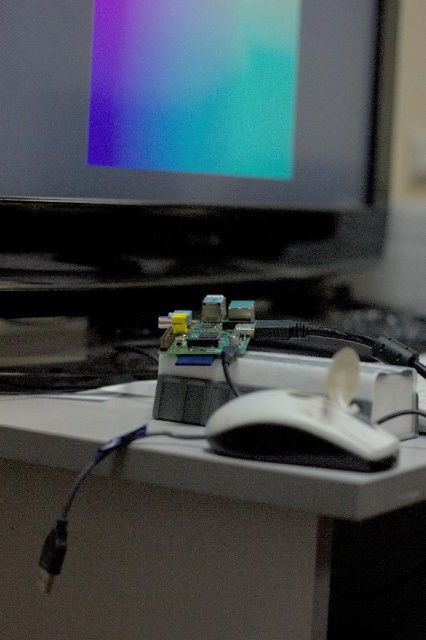
Is white matte table at center positioned before white matte mouse at center?

Yes, it is in front of white matte mouse at center.

Does point (17, 444) come behind point (333, 461)?

Yes, it is behind point (333, 461).

Identify the location of white matte table at center. (170, 528).

Does matte black monitor at upper center appear on the right side of white matte table at center?

Yes, matte black monitor at upper center is to the right of white matte table at center.

Which is more to the right, matte black monitor at upper center or white matte table at center?

From the viewer's perspective, matte black monitor at upper center appears more on the right side.

Where is `matte black monitor at upper center`? The height and width of the screenshot is (640, 426). matte black monitor at upper center is located at coordinates (198, 132).

Image resolution: width=426 pixels, height=640 pixels. Find the location of `matte black monitor at upper center`. matte black monitor at upper center is located at coordinates (198, 132).

In the scene shown: Who is lower down, matte black monitor at upper center or white matte mouse at center?

white matte mouse at center is below.

Can you confirm if matte black monitor at upper center is positioned to the right of white matte mouse at center?

In fact, matte black monitor at upper center is to the left of white matte mouse at center.

Which is behind, point (144, 196) or point (325, 456)?

The point (144, 196) is behind.

What are the coordinates of `matte black monitor at upper center` in the screenshot? It's located at (198, 132).